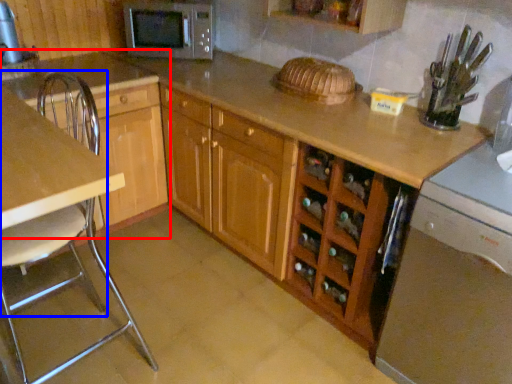
Question: Which of the following is the farthest to the observer, cabinetry (highlighted by a red box) or chair (highlighted by a blue box)?

Choices:
 (A) cabinetry
 (B) chair

Answer: (A)